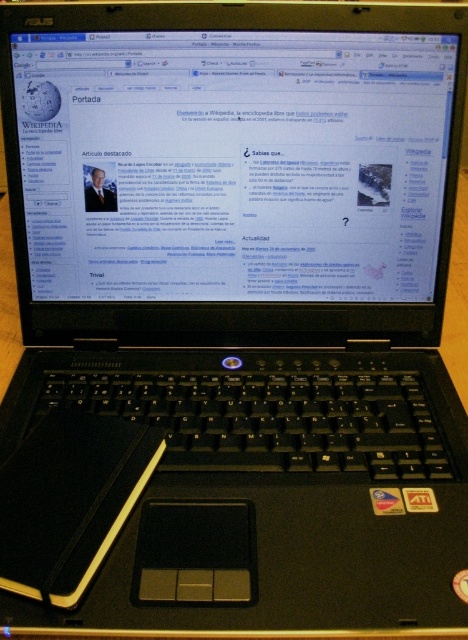
You are trying to place your black leather notebook at lower left on the matte black screen at center. Is the screen wide enough to hold the notebook?

The matte black screen at center might be wider than black leather notebook at lower left, so it is possible that the screen can accommodate the notebook. However, the exact dimensions are uncertain due to the description using the word

You are designing a layout for a poster and need to know the relative sizes of the objects in the image. Which object is taller between the matte black screen at center and the black leather notebook at lower left?

The matte black screen at center is much taller than the black leather notebook at lower left.

You are a student who needs to take notes on the Wikipedia page about Ricardo Lagos Escobar. You have a black leather notebook at lower left. Can you see the entire matte black screen at center while writing in your notebook?

The matte black screen at center is positioned over the black leather notebook at lower left, so the screen is above the notebook. You can see the entire matte black screen at center while writing in your notebook because it is not obstructed by the notebook.